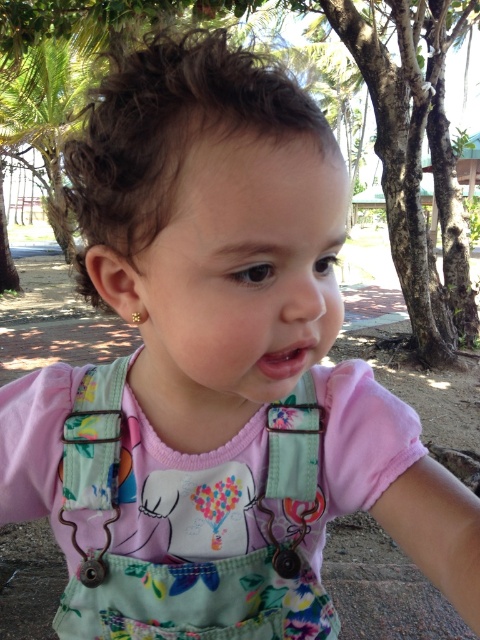
You are a tailor trying to decide which strap to use for a new accessory design. The metallic fabric strap at lower left and the floral fabric strap at center are both options. Which strap is bigger in size?

The metallic fabric strap at lower left has a larger size compared to the floral fabric strap at center, so the metallic fabric strap at lower left is bigger in size.

The child is holding two straps. The metallic fabric strap at lower left and the floral fabric strap at center. Which strap is taller?

The metallic fabric strap at lower left is taller than the floral fabric strap at center.